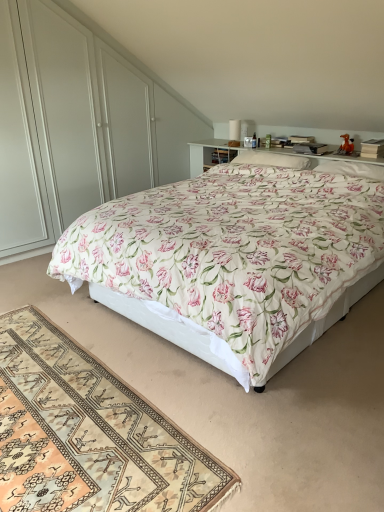
Question: Is white soft pillow at upper right, the 1th pillow from the right, aimed at beige woven rug at lower left?

Choices:
 (A) no
 (B) yes

Answer: (A)

Question: From a real-world perspective, is white soft pillow at upper right, the 1th pillow from the right, beneath beige woven rug at lower left?

Choices:
 (A) yes
 (B) no

Answer: (B)

Question: Does white soft pillow at upper right, the 1th pillow from the right, have a greater width compared to beige woven rug at lower left?

Choices:
 (A) yes
 (B) no

Answer: (B)

Question: Considering the relative positions of white soft pillow at upper right, the 2th pillow when ordered from left to right, and beige woven rug at lower left in the image provided, is white soft pillow at upper right, the 2th pillow when ordered from left to right, in front of beige woven rug at lower left?

Choices:
 (A) no
 (B) yes

Answer: (A)

Question: Can you confirm if white soft pillow at upper right, the 1th pillow from the right, is bigger than beige woven rug at lower left?

Choices:
 (A) yes
 (B) no

Answer: (B)

Question: Is beige woven rug at lower left completely or partially inside white soft pillow at upper right, the 1th pillow from the right?

Choices:
 (A) yes
 (B) no

Answer: (B)

Question: Does white soft pillow at center, the 2th pillow viewed from the right, have a lesser width compared to white glossy dresser at upper center?

Choices:
 (A) yes
 (B) no

Answer: (B)

Question: Is white soft pillow at center, the 2th pillow viewed from the right, positioned far away from white glossy dresser at upper center?

Choices:
 (A) no
 (B) yes

Answer: (B)

Question: Does white soft pillow at center, the 1th pillow viewed from the left, have a smaller size compared to white glossy dresser at upper center?

Choices:
 (A) no
 (B) yes

Answer: (B)

Question: From a real-world perspective, is white soft pillow at center, the 2th pillow viewed from the right, positioned under white glossy dresser at upper center based on gravity?

Choices:
 (A) yes
 (B) no

Answer: (A)

Question: Does white soft pillow at center, the 1th pillow viewed from the left, have a larger size compared to white glossy dresser at upper center?

Choices:
 (A) yes
 (B) no

Answer: (B)

Question: Is white soft pillow at center, the 1th pillow viewed from the left, taller than white glossy dresser at upper center?

Choices:
 (A) yes
 (B) no

Answer: (B)

Question: From a real-world perspective, is white glossy dresser at upper center located beneath beige woven rug at lower left?

Choices:
 (A) no
 (B) yes

Answer: (A)